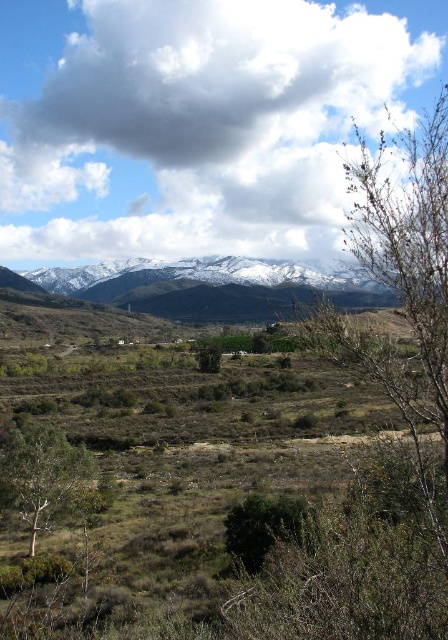
You are a GUI agent. You are given a task and a screenshot of the screen. Output one action in this format:
    pyautogui.click(x=<x>, y=<y>)
    Task: Click on the bare branches at right
    The height and width of the screenshot is (640, 448).
    Given the screenshot: What is the action you would take?
    pyautogui.click(x=401, y=289)

Is bare branches at right thinner than green leafy tree at center?

In fact, bare branches at right might be wider than green leafy tree at center.

Describe the element at coordinates (401, 289) in the screenshot. I see `bare branches at right` at that location.

Locate an element on the screen. bare branches at right is located at coordinates (401, 289).

Is white snow-covered mountain range at upper center positioned behind green leafy tree at lower left?

That is True.

Is white snow-covered mountain range at upper center below green leafy tree at lower left?

Actually, white snow-covered mountain range at upper center is above green leafy tree at lower left.

Who is more distant from viewer, (232, 275) or (44, 522)?

The point (232, 275) is behind.

In order to click on white snow-covered mountain range at upper center in this screenshot , I will do `click(210, 285)`.

Can you confirm if white fluffy cloud at upper center is positioned to the right of green leafy tree at center?

Yes, white fluffy cloud at upper center is to the right of green leafy tree at center.

Can you confirm if white fluffy cloud at upper center is positioned above green leafy tree at center?

Indeed, white fluffy cloud at upper center is positioned over green leafy tree at center.

The image size is (448, 640). Find the location of `white fluffy cloud at upper center`. white fluffy cloud at upper center is located at coordinates [197, 122].